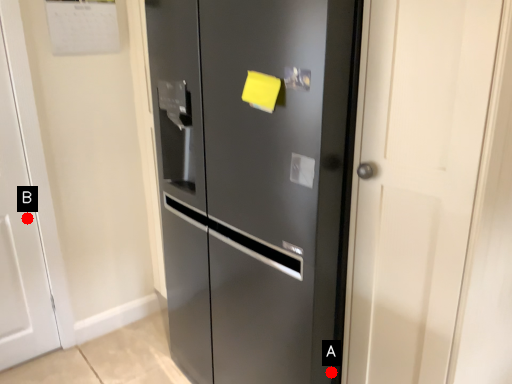
Question: Two points are circled on the image, labeled by A and B beside each circle. Among these points, which one is farthest from the camera?

Choices:
 (A) A is further
 (B) B is further

Answer: (B)